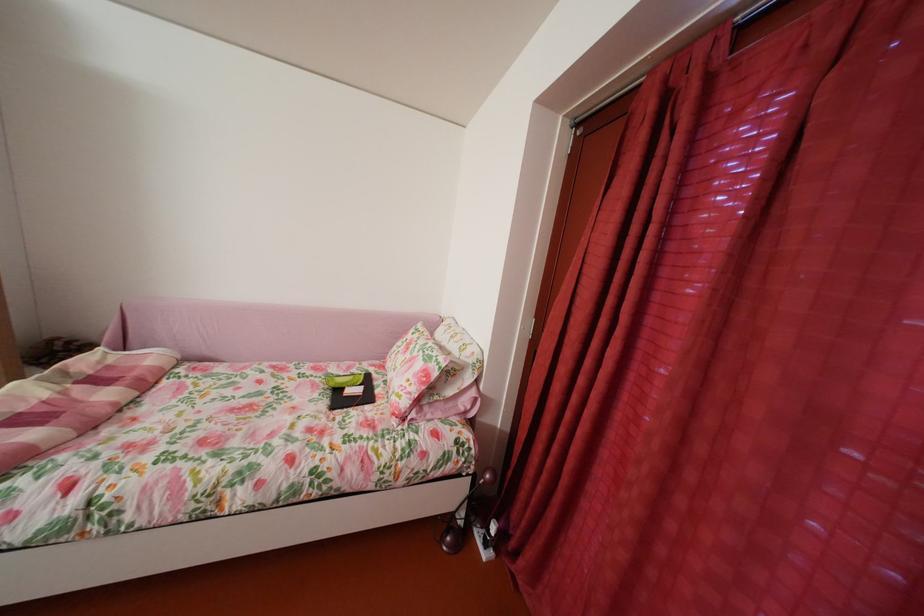
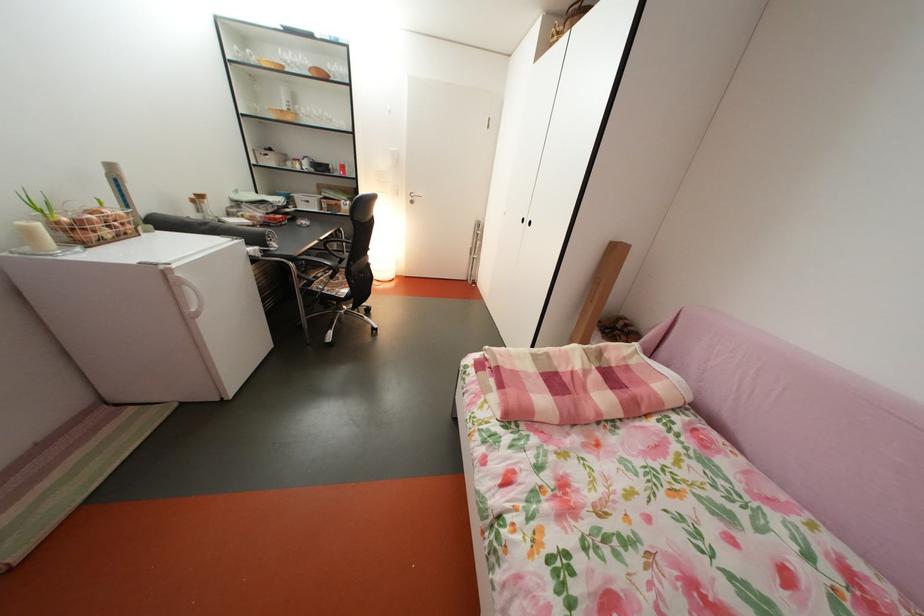
The first image is from the beginning of the video and the second image is from the end. How did the camera likely rotate when shooting the video?

The camera rotated toward left-down.